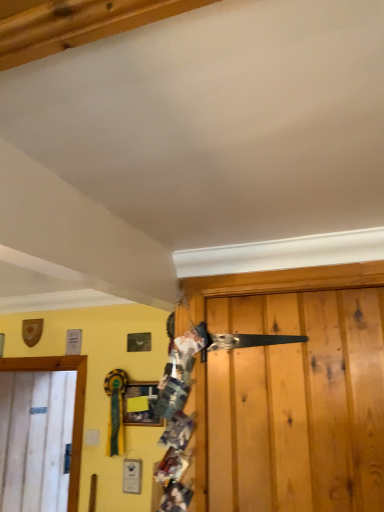
Question: Considering the relative sizes of white wood door at left and multicolored fabric at center in the image provided, is white wood door at left smaller than multicolored fabric at center?

Choices:
 (A) no
 (B) yes

Answer: (A)

Question: Does white wood door at left appear on the right side of multicolored fabric at center?

Choices:
 (A) yes
 (B) no

Answer: (B)

Question: From the image's perspective, does white wood door at left appear lower than multicolored fabric at center?

Choices:
 (A) no
 (B) yes

Answer: (B)

Question: From the image's perspective, is white wood door at left located above multicolored fabric at center?

Choices:
 (A) no
 (B) yes

Answer: (A)

Question: From a real-world perspective, is white wood door at left on top of multicolored fabric at center?

Choices:
 (A) yes
 (B) no

Answer: (B)

Question: Considering the relative sizes of white wood door at left and multicolored fabric at center in the image provided, is white wood door at left taller than multicolored fabric at center?

Choices:
 (A) yes
 (B) no

Answer: (A)

Question: Can you confirm if white wood door at left is smaller than matte wooden picture frame at center?

Choices:
 (A) yes
 (B) no

Answer: (B)

Question: Does white wood door at left lie in front of matte wooden picture frame at center?

Choices:
 (A) no
 (B) yes

Answer: (A)

Question: Is white wood door at left outside matte wooden picture frame at center?

Choices:
 (A) yes
 (B) no

Answer: (A)

Question: From a real-world perspective, is white wood door at left below matte wooden picture frame at center?

Choices:
 (A) yes
 (B) no

Answer: (A)

Question: Could you tell me if white wood door at left is facing matte wooden picture frame at center?

Choices:
 (A) yes
 (B) no

Answer: (A)

Question: From the image's perspective, is white wood door at left on top of matte wooden picture frame at center?

Choices:
 (A) yes
 (B) no

Answer: (B)

Question: Are matte wooden picture frame at center and white wood door at left located far from each other?

Choices:
 (A) no
 (B) yes

Answer: (A)